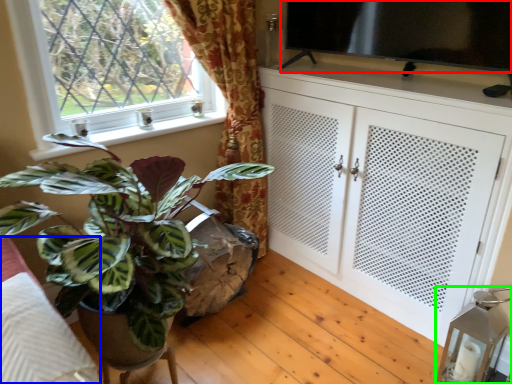
Question: Based on their relative distances, which object is nearer to window screen (highlighted by a red box)? Choose from bedding (highlighted by a blue box) and lamp (highlighted by a green box).

Choices:
 (A) bedding
 (B) lamp

Answer: (B)